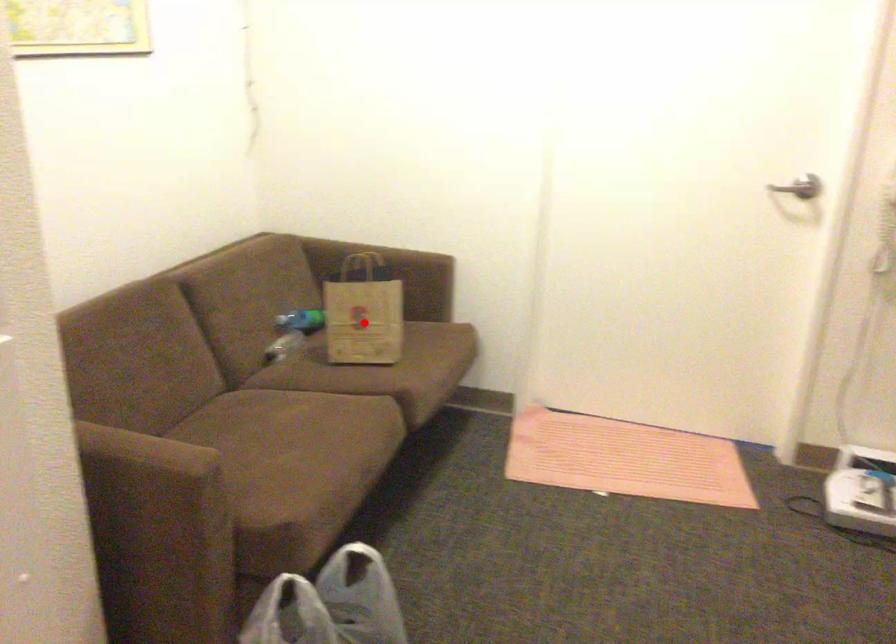
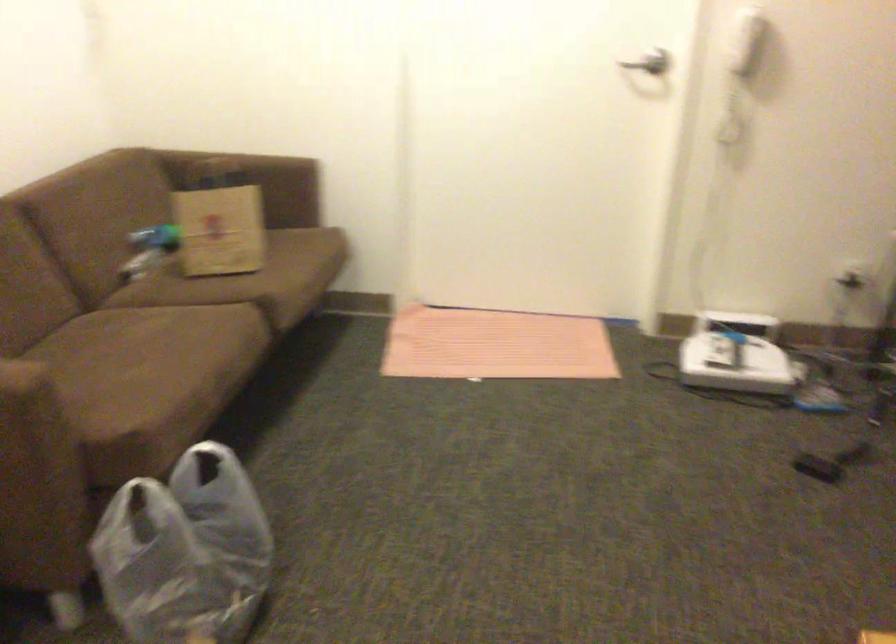
The point at the highlighted location is marked in the first image. Where is the corresponding point in the second image?

(220, 230)